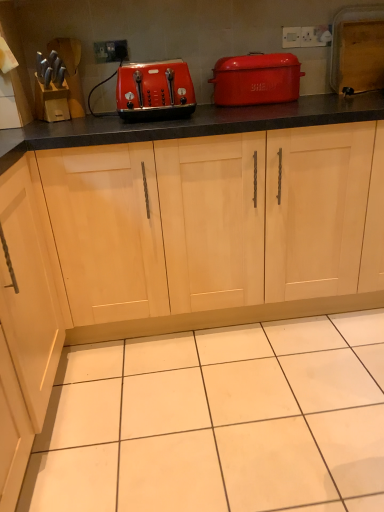
Question: Is matte red bread bin at upper center wider or thinner than light wood cabinet at center?

Choices:
 (A) wide
 (B) thin

Answer: (B)

Question: From the image's perspective, is matte red bread bin at upper center above or below light wood cabinet at center?

Choices:
 (A) above
 (B) below

Answer: (A)

Question: Which of these objects is positioned closest to the matte plastic toaster at center?

Choices:
 (A) white plastic electric outlet at upper center
 (B) light wood cabinet at center
 (C) matte red bread bin at upper center

Answer: (C)

Question: Which of these objects is positioned farthest from the light wood cabinet at center?

Choices:
 (A) white plastic electric outlet at upper center
 (B) matte red bread bin at upper center
 (C) matte plastic toaster at center

Answer: (A)